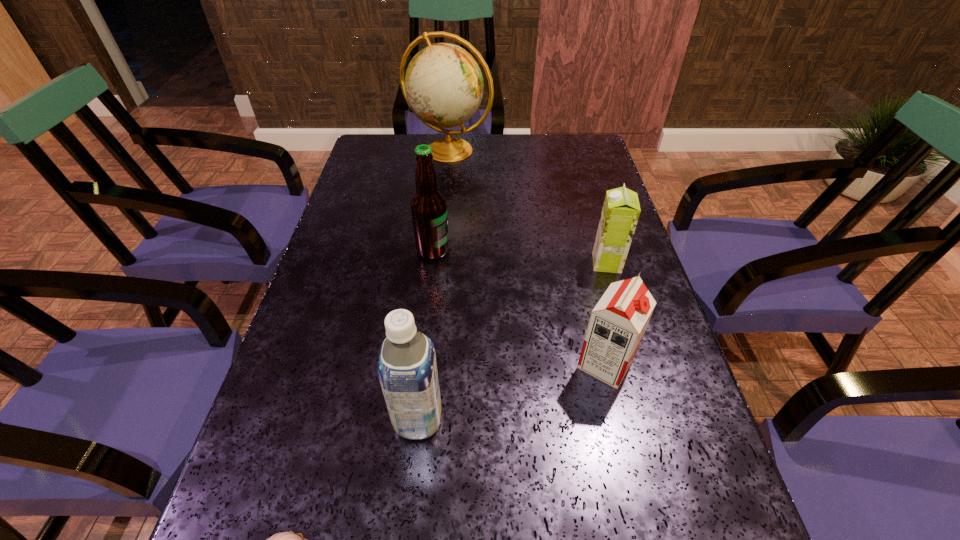
At what (x,y) coordinates should I click in order to perform the action: click on free area in between the tallest object and the second nearest object. Please return your answer as a coordinate pair (x, y). The height and width of the screenshot is (540, 960). Looking at the image, I should click on (434, 285).

Locate an element on the screen. The height and width of the screenshot is (540, 960). free spot between the farthest object and the farthest soya milk is located at coordinates (528, 206).

At what (x,y) coordinates should I click in order to perform the action: click on the fifth closest object to the farthest soya milk. Please return your answer as a coordinate pair (x, y). Looking at the image, I should click on (283, 539).

This screenshot has width=960, height=540. Identify the location of object that can be found as the closest to the tallest object. (428, 205).

Image resolution: width=960 pixels, height=540 pixels. Identify the location of the second closest soya milk to the beer bottle. (617, 324).

Identify the location of soya milk that is the third closest to the cupcake. The width and height of the screenshot is (960, 540). coord(621,209).

At what (x,y) coordinates should I click in order to perform the action: click on vacant position in the image that satisfies the following two spatial constraints: 1. on the front side of the second farthest soya milk; 2. on the label of the fifth farthest object. Please return your answer as a coordinate pair (x, y). This screenshot has width=960, height=540. Looking at the image, I should click on (619, 419).

Find the location of a particular element. This screenshot has width=960, height=540. blank area in the image that satisfies the following two spatial constraints: 1. on the label of the beer bottle; 2. on the right side of the second nearest soya milk is located at coordinates (420, 363).

You are a GUI agent. You are given a task and a screenshot of the screen. Output one action in this format:
    pyautogui.click(x=<x>, y=<y>)
    Task: Click on the vacant point that satisfies the following two spatial constraints: 1. on the label of the beer bottle; 2. on the left side of the second nearest soya milk
    The image size is (960, 540).
    Given the screenshot: What is the action you would take?
    pyautogui.click(x=420, y=363)